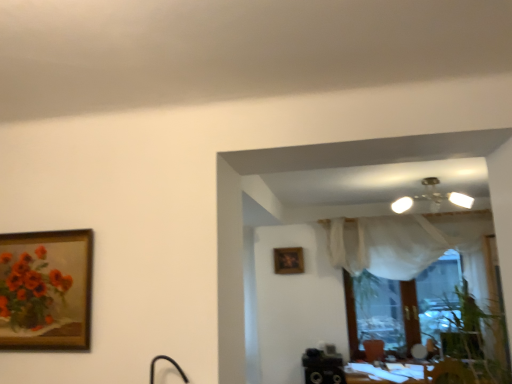
Question: Is matte floral painting at left to the left of wooden frame at center from the viewer's perspective?

Choices:
 (A) no
 (B) yes

Answer: (B)

Question: Does matte floral painting at left have a smaller size compared to wooden frame at center?

Choices:
 (A) yes
 (B) no

Answer: (B)

Question: Is matte floral painting at left next to wooden frame at center?

Choices:
 (A) yes
 (B) no

Answer: (B)

Question: Considering the relative sizes of matte floral painting at left and wooden frame at center in the image provided, is matte floral painting at left bigger than wooden frame at center?

Choices:
 (A) no
 (B) yes

Answer: (B)

Question: Can you confirm if matte floral painting at left is wider than wooden frame at center?

Choices:
 (A) no
 (B) yes

Answer: (A)

Question: From a real-world perspective, is matte floral painting at left positioned under wooden frame at center based on gravity?

Choices:
 (A) yes
 (B) no

Answer: (A)

Question: Is wooden frame at center oriented away from white glossy table at lower right?

Choices:
 (A) no
 (B) yes

Answer: (A)

Question: Considering the relative sizes of wooden frame at center and white glossy table at lower right in the image provided, is wooden frame at center bigger than white glossy table at lower right?

Choices:
 (A) yes
 (B) no

Answer: (B)

Question: From the image's perspective, is wooden frame at center on top of white glossy table at lower right?

Choices:
 (A) yes
 (B) no

Answer: (A)

Question: Is wooden frame at center not near white glossy table at lower right?

Choices:
 (A) yes
 (B) no

Answer: (A)

Question: Does wooden frame at center have a greater width compared to white glossy table at lower right?

Choices:
 (A) no
 (B) yes

Answer: (A)

Question: Is wooden frame at center thinner than white glossy table at lower right?

Choices:
 (A) no
 (B) yes

Answer: (B)

Question: Considering the relative sizes of wooden frame at center and matte floral painting at left in the image provided, is wooden frame at center bigger than matte floral painting at left?

Choices:
 (A) yes
 (B) no

Answer: (B)